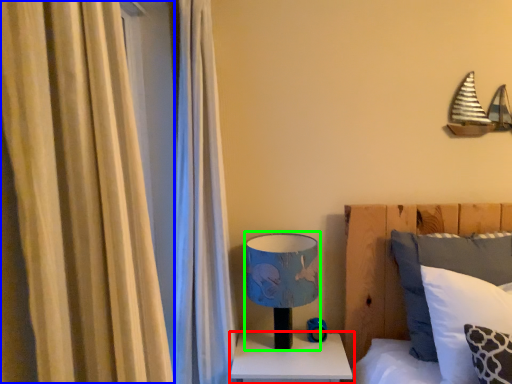
Question: Based on their relative distances, which object is farther from nightstand (highlighted by a red box)? Choose from curtain (highlighted by a blue box) and table lamp (highlighted by a green box).

Choices:
 (A) curtain
 (B) table lamp

Answer: (A)